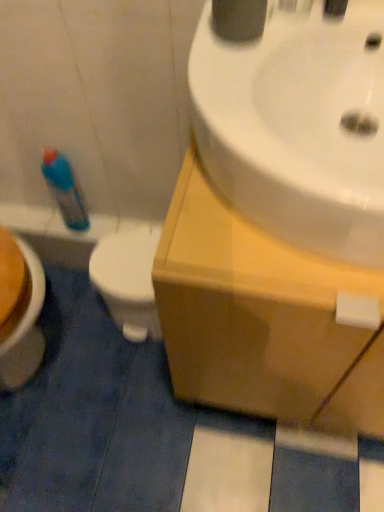
Where is `free space in front of white glossy toilet at lower left`? The image size is (384, 512). free space in front of white glossy toilet at lower left is located at coordinates (119, 372).